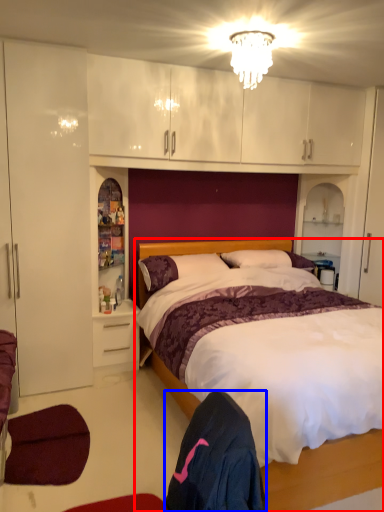
Question: Which object is further to the camera taking this photo, bed (highlighted by a red box) or robe (highlighted by a blue box)?

Choices:
 (A) bed
 (B) robe

Answer: (A)